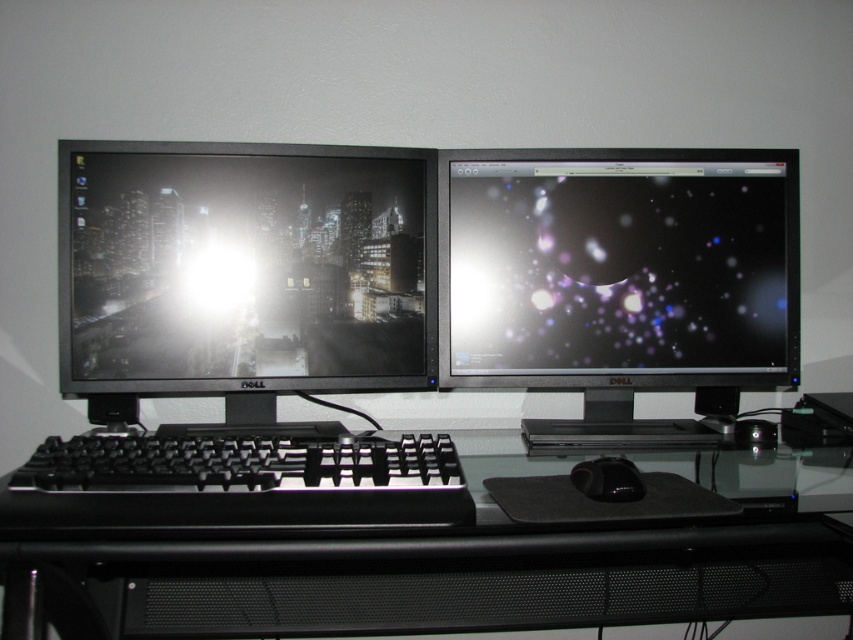
Looking at this image, which is more to the right, black glass computer desk at center or matte black monitor at left?

black glass computer desk at center is more to the right.

Which is behind, point (83, 518) or point (386, 275)?

Positioned behind is point (386, 275).

Between point (283, 440) and point (241, 269), which one is positioned behind?

The point (241, 269) is more distant.

The height and width of the screenshot is (640, 853). I want to click on black glass computer desk at center, so click(x=405, y=538).

Does black plastic keyboard at center appear under black rubber mouse at center?

No, black plastic keyboard at center is not below black rubber mouse at center.

Consider the image. Measure the distance from black plastic keyboard at center to black rubber mouse at center.

black plastic keyboard at center is 26.67 centimeters from black rubber mouse at center.

Measure the distance between point [213,525] and camera.

They are 24.91 inches apart.

Image resolution: width=853 pixels, height=640 pixels. In order to click on black plastic keyboard at center in this screenshot , I will do `click(236, 483)`.

Is point (480, 310) more distant than point (169, 476)?

Yes, point (480, 310) is farther from viewer.

Between matte black monitor at right and black plastic keyboard at center, which one has more height?

With more height is matte black monitor at right.

The width and height of the screenshot is (853, 640). What do you see at coordinates (619, 282) in the screenshot?
I see `matte black monitor at right` at bounding box center [619, 282].

I want to click on matte black monitor at right, so click(619, 282).